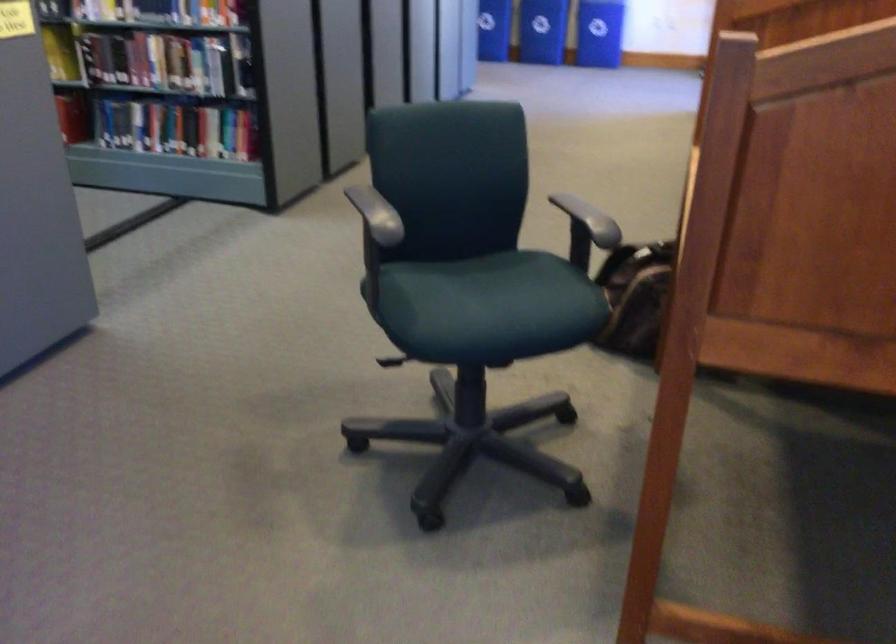
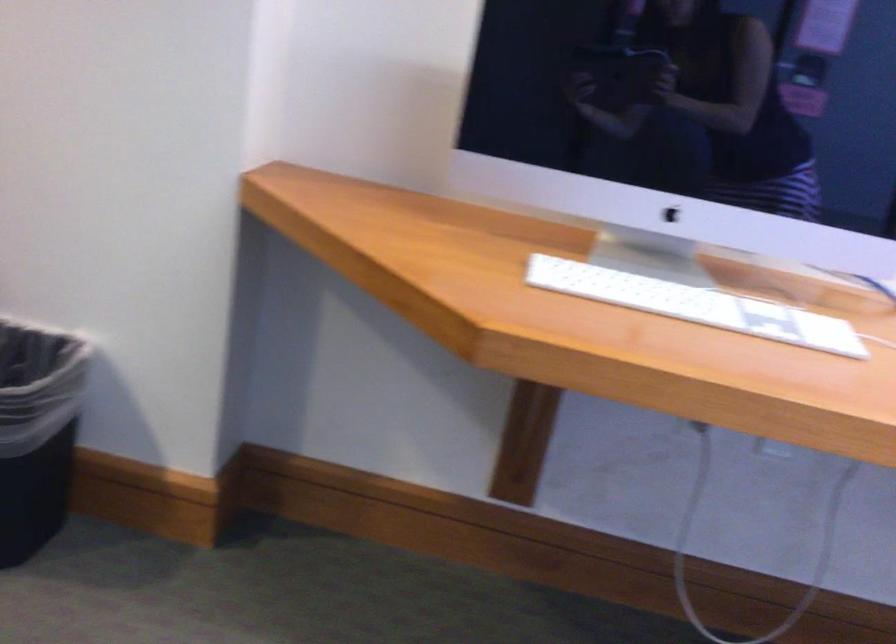
How did the camera likely rotate?

The camera's rotation is toward right-down.